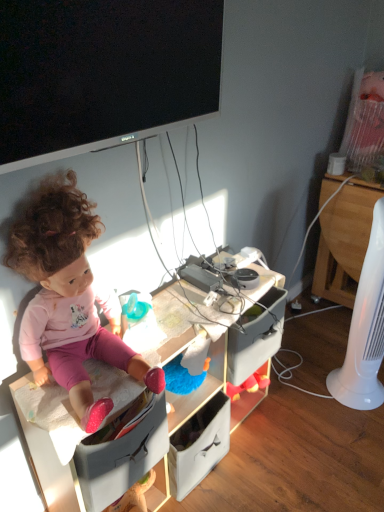
You are a GUI agent. You are given a task and a screenshot of the screen. Output one action in this format:
    pyautogui.click(x=<x>, y=<y>)
    Task: Click on the free space that is to the left of white plastic fan at right
    The width and height of the screenshot is (384, 512).
    Given the screenshot: What is the action you would take?
    pyautogui.click(x=305, y=389)